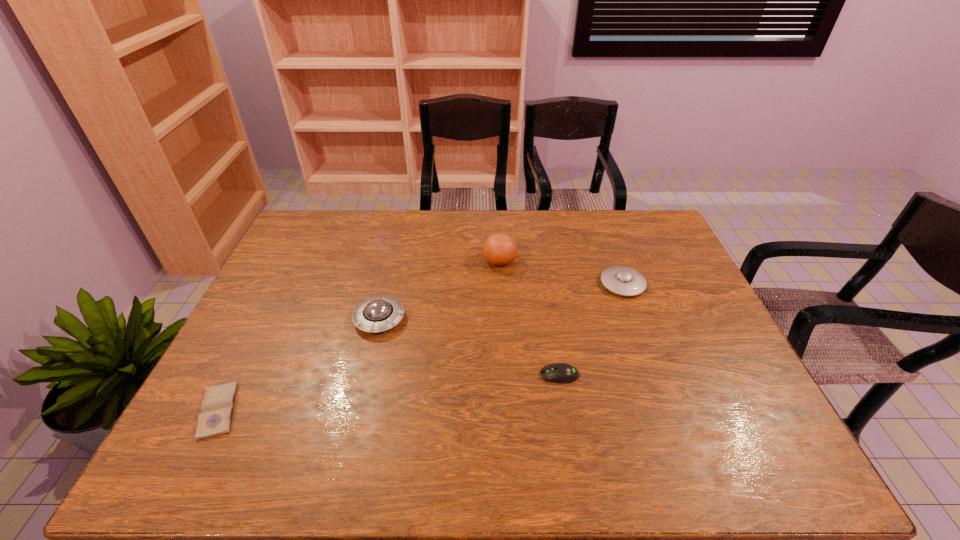
I want to click on free space between the computer mouse and the fourth object from right to left, so click(x=469, y=347).

The image size is (960, 540). Identify the location of free point between the right saucer and the third object from right to left. (561, 272).

Find the location of `vacant space that is in between the third nearest object and the nearest object`. vacant space that is in between the third nearest object and the nearest object is located at coordinates (299, 365).

This screenshot has height=540, width=960. Find the location of `empty location between the diary and the rightmost object`. empty location between the diary and the rightmost object is located at coordinates (420, 348).

Where is `vacant space that is in between the second tallest object and the diary`? The width and height of the screenshot is (960, 540). vacant space that is in between the second tallest object and the diary is located at coordinates 299,365.

Where is `vacant point located between the tallest object and the farther saucer`? This screenshot has width=960, height=540. vacant point located between the tallest object and the farther saucer is located at coordinates (561, 272).

Locate an element on the screen. The image size is (960, 540). object that is the third nearest to the diary is located at coordinates click(499, 249).

I want to click on object that is the closest to the second nearest object, so click(620, 280).

What are the coordinates of `vacant position in the image that satisfies the following two spatial constraints: 1. on the wheel side of the computer mouse; 2. on the front side of the leftmost object` in the screenshot? It's located at (564, 411).

Locate an element on the screen. The width and height of the screenshot is (960, 540). vacant space that satisfies the following two spatial constraints: 1. on the front side of the shorter saucer; 2. on the wheel side of the fourth farthest object is located at coordinates click(x=656, y=375).